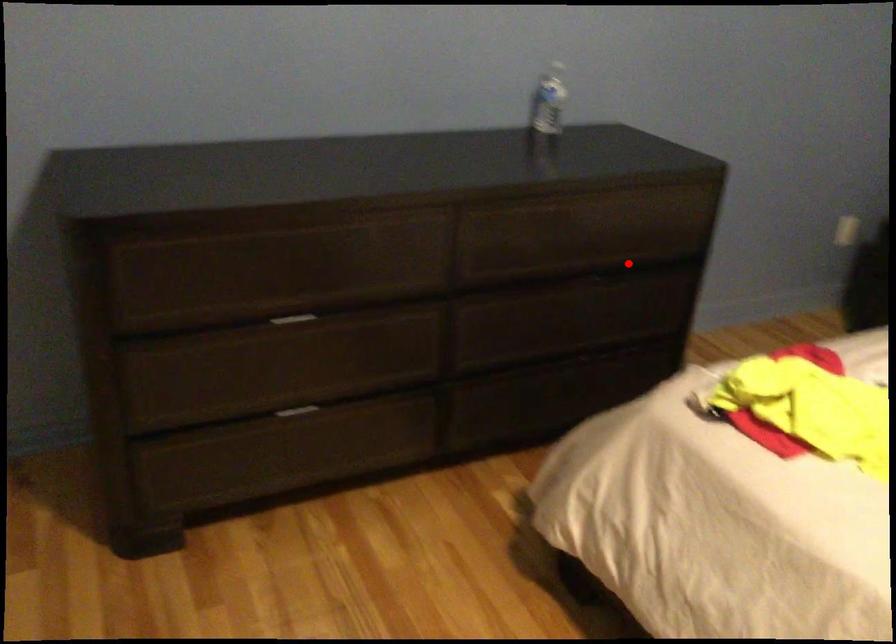
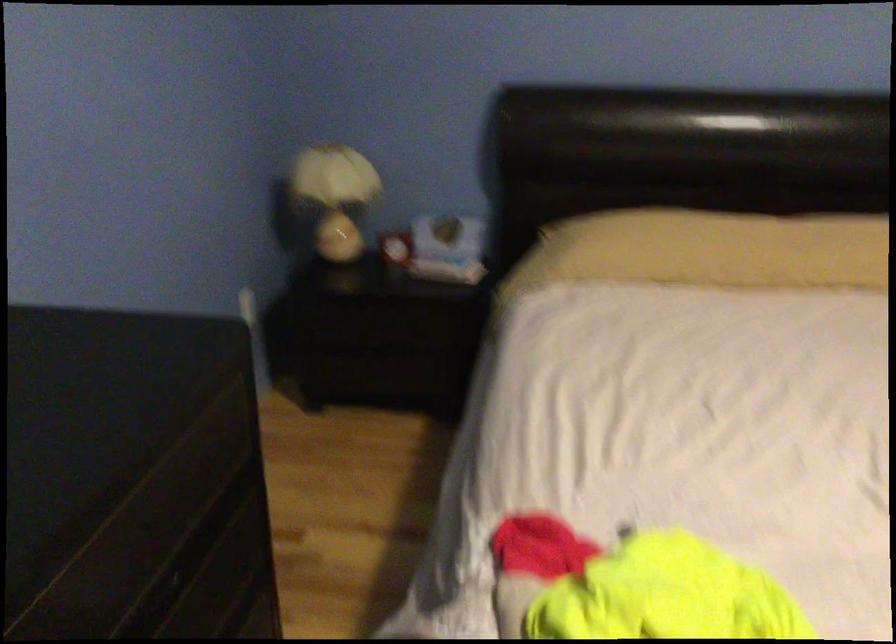
Locate, in the second image, the point that corresponds to the highlighted location in the first image.

(186, 559)